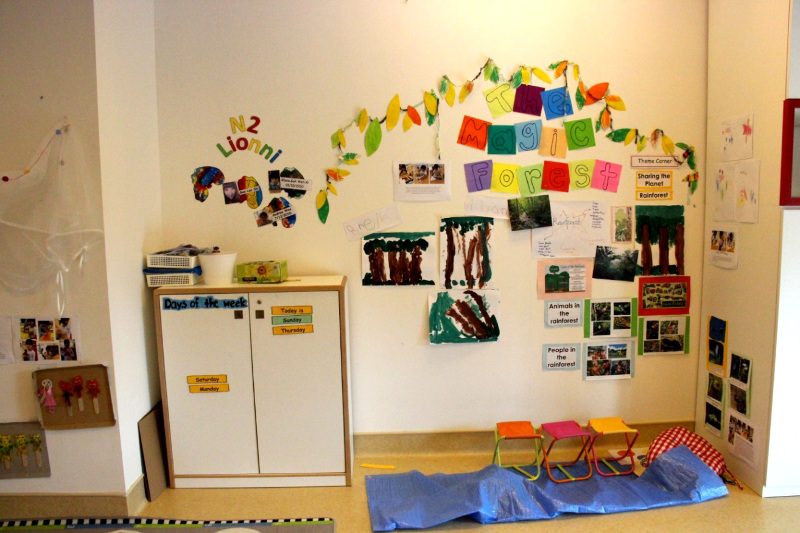
Where is `rug`? This screenshot has width=800, height=533. rug is located at coordinates [182, 529].